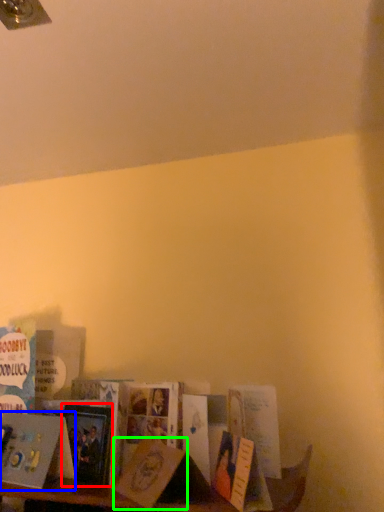
Question: Which is nearer to the paperback book (highlighted by a red box)? book (highlighted by a blue box) or paperback book (highlighted by a green box).

Choices:
 (A) book
 (B) paperback book

Answer: (A)